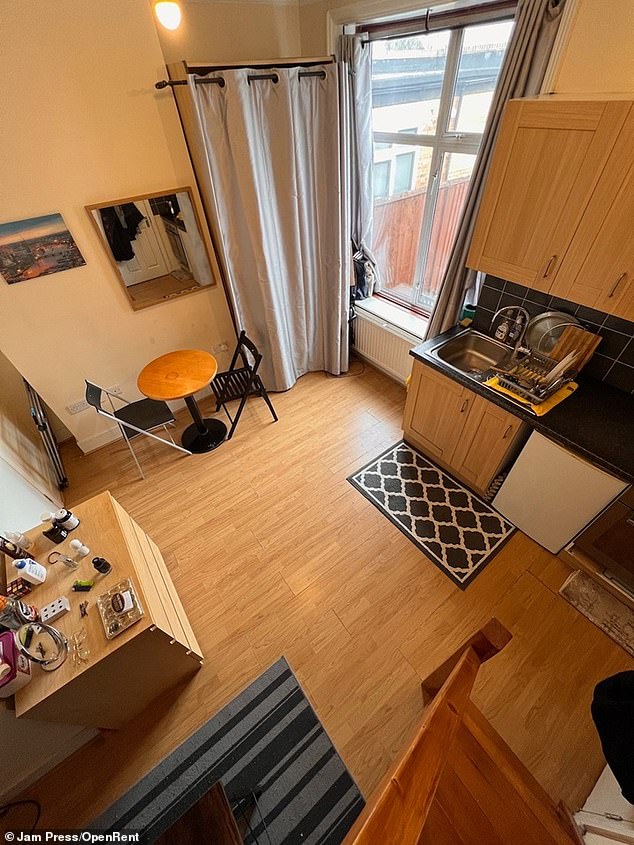
This screenshot has height=845, width=634. I want to click on curtain, so click(x=301, y=264), click(x=364, y=124), click(x=527, y=74).